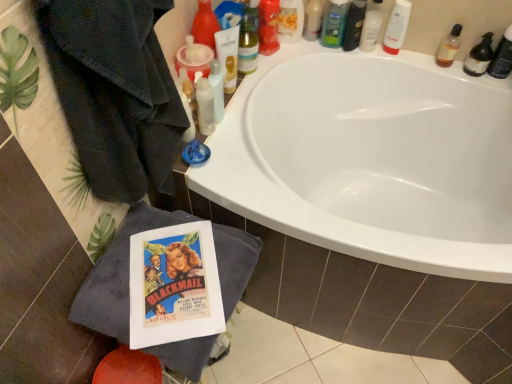
Where is `vintage paper comic book at lower left`? This screenshot has width=512, height=384. vintage paper comic book at lower left is located at coordinates (174, 285).

At what (x,y) coordinates should I click in order to perform the action: click on translucent plastic tube at upper center, the second mouthwash viewed from the right. Please return your answer as a coordinate pair (x, y). The image size is (512, 384). Looking at the image, I should click on (228, 56).

Measure the distance between white plastic bottle at upper right, which is the 7th toiletry from left to right, and camera.

They are 4.24 feet apart.

What is the approximate width of shiny plastic bottle at upper right, which appears as the fifth toiletry when viewed from the right?

It is 3.16 inches.

Find the location of a particular element. The image size is (512, 384). white plastic tube at upper right, acting as the 6th toiletry starting from the left is located at coordinates (371, 26).

Does translucent plastic bottle at upper center, the 9th toiletry positioned from the right, turn towards translucent plastic mouthwash at upper right, marked as the 2th mouthwash in a left-to-right arrangement?

No, translucent plastic bottle at upper center, the 9th toiletry positioned from the right, is not facing towards translucent plastic mouthwash at upper right, marked as the 2th mouthwash in a left-to-right arrangement.

Is translucent plastic mouthwash at upper right, marked as the 2th mouthwash in a left-to-right arrangement, inside translucent plastic bottle at upper center, the 9th toiletry positioned from the right?

No.

Which is more to the right, translucent plastic bottle at upper center, the 9th toiletry positioned from the right, or translucent plastic mouthwash at upper right, marked as the 2th mouthwash in a left-to-right arrangement?

translucent plastic mouthwash at upper right, marked as the 2th mouthwash in a left-to-right arrangement, is more to the right.

How different are the orientations of translucent plastic bottle at upper center, the 9th toiletry positioned from the right, and translucent plastic mouthwash at upper right, acting as the first mouthwash starting from the right, in degrees?

They differ by 95.4 degrees in their facing directions.

Is translucent plastic bottle at upper center, the 9th toiletry positioned from the right, inside shiny plastic bottle at upper right, which ranks as the 5th toiletry in left-to-right order?

Definitely not — translucent plastic bottle at upper center, the 9th toiletry positioned from the right, is not inside shiny plastic bottle at upper right, which ranks as the 5th toiletry in left-to-right order.

From a real-world perspective, starting from the translucent plastic bottle at upper center, the 9th toiletry positioned from the right, which toiletry is the 2nd one below it? Please provide its 2D coordinates.

[(354, 25)]

From a real-world perspective, who is located lower, shiny plastic bottle at upper right, which ranks as the 5th toiletry in left-to-right order, or translucent plastic bottle at upper center, the 9th toiletry positioned from the right?

shiny plastic bottle at upper right, which ranks as the 5th toiletry in left-to-right order, from a real-world perspective.

Is shiny plastic bottle at upper right, which appears as the fifth toiletry when viewed from the right, far away from translucent plastic bottle at upper center, the 9th toiletry positioned from the right?

No, shiny plastic bottle at upper right, which appears as the fifth toiletry when viewed from the right, is not far away from translucent plastic bottle at upper center, the 9th toiletry positioned from the right.

Based on the photo, is vintage paper comic book at lower left to the left of translucent plastic mouthwash at upper right, acting as the first mouthwash starting from the right, from the viewer's perspective?

Correct, you'll find vintage paper comic book at lower left to the left of translucent plastic mouthwash at upper right, acting as the first mouthwash starting from the right.

Considering the sizes of objects vintage paper comic book at lower left and translucent plastic mouthwash at upper right, marked as the 2th mouthwash in a left-to-right arrangement, in the image provided, who is shorter, vintage paper comic book at lower left or translucent plastic mouthwash at upper right, marked as the 2th mouthwash in a left-to-right arrangement,?

With less height is vintage paper comic book at lower left.

Which object is more forward, vintage paper comic book at lower left or translucent plastic mouthwash at upper right, acting as the first mouthwash starting from the right?

vintage paper comic book at lower left is in front.

Measure the distance from vintage paper comic book at lower left to translucent plastic mouthwash at upper right, marked as the 2th mouthwash in a left-to-right arrangement.

vintage paper comic book at lower left and translucent plastic mouthwash at upper right, marked as the 2th mouthwash in a left-to-right arrangement, are 3.55 feet apart from each other.

Is green matte bottle at upper center, positioned as the fourth toiletry in left-to-right order, taller than translucent plastic mouthwash at upper right, acting as the first mouthwash starting from the right?

Correct, green matte bottle at upper center, positioned as the fourth toiletry in left-to-right order, is much taller as translucent plastic mouthwash at upper right, acting as the first mouthwash starting from the right.

Is green matte bottle at upper center, positioned as the fourth toiletry in left-to-right order, positioned far away from translucent plastic mouthwash at upper right, marked as the 2th mouthwash in a left-to-right arrangement?

No, green matte bottle at upper center, positioned as the fourth toiletry in left-to-right order, is not far away from translucent plastic mouthwash at upper right, marked as the 2th mouthwash in a left-to-right arrangement.

The height and width of the screenshot is (384, 512). I want to click on mouthwash that is under the green matte bottle at upper center, the 6th toiletry from the right (from a real-world perspective), so click(479, 57).

Which is behind, point (336, 8) or point (479, 61)?

The point (336, 8) is more distant.

Looking at this image, from the image's perspective, between green matte bottle at upper center, positioned as the fourth toiletry in left-to-right order, and translucent plastic bottle at upper right, the 1th toiletry in the right-to-left sequence, who is located below?

translucent plastic bottle at upper right, the 1th toiletry in the right-to-left sequence, from the image's perspective.

Can you confirm if green matte bottle at upper center, positioned as the fourth toiletry in left-to-right order, is taller than translucent plastic bottle at upper right, the 1th toiletry in the right-to-left sequence?

In fact, green matte bottle at upper center, positioned as the fourth toiletry in left-to-right order, may be shorter than translucent plastic bottle at upper right, the 1th toiletry in the right-to-left sequence.

Choose the correct answer: Is green matte bottle at upper center, positioned as the fourth toiletry in left-to-right order, inside translucent plastic bottle at upper right, which ranks as the 9th toiletry in left-to-right order, or outside it?

green matte bottle at upper center, positioned as the fourth toiletry in left-to-right order, is outside translucent plastic bottle at upper right, which ranks as the 9th toiletry in left-to-right order.

Between green matte bottle at upper center, the 6th toiletry from the right, and translucent plastic bottle at upper right, which ranks as the 9th toiletry in left-to-right order, which one has smaller width?

With smaller width is translucent plastic bottle at upper right, which ranks as the 9th toiletry in left-to-right order.

Considering the sizes of objects translucent plastic bottle at upper right, arranged as the 8th toiletry when viewed from the left, and translucent plastic bottle at upper right, which ranks as the 9th toiletry in left-to-right order, in the image provided, who is bigger, translucent plastic bottle at upper right, arranged as the 8th toiletry when viewed from the left, or translucent plastic bottle at upper right, which ranks as the 9th toiletry in left-to-right order,?

translucent plastic bottle at upper right, which ranks as the 9th toiletry in left-to-right order, is bigger.

Is translucent plastic bottle at upper right, arranged as the 8th toiletry when viewed from the left, taller than translucent plastic bottle at upper right, the 1th toiletry in the right-to-left sequence?

No.

Measure the distance between translucent plastic bottle at upper right, which ranks as the 2th toiletry in right-to-left order, and translucent plastic bottle at upper right, which ranks as the 9th toiletry in left-to-right order.

The distance of translucent plastic bottle at upper right, which ranks as the 2th toiletry in right-to-left order, from translucent plastic bottle at upper right, which ranks as the 9th toiletry in left-to-right order, is 5.28 inches.

In the image, is translucent plastic bottle at upper right, which ranks as the 2th toiletry in right-to-left order, positioned in front of or behind translucent plastic bottle at upper right, which ranks as the 9th toiletry in left-to-right order?

Visually, translucent plastic bottle at upper right, which ranks as the 2th toiletry in right-to-left order, is located behind translucent plastic bottle at upper right, which ranks as the 9th toiletry in left-to-right order.

Is translucent plastic mouthwash at upper right, marked as the 2th mouthwash in a left-to-right arrangement, oriented towards translucent plastic bottle at upper center, the 9th toiletry positioned from the right?

No, translucent plastic mouthwash at upper right, marked as the 2th mouthwash in a left-to-right arrangement, does not turn towards translucent plastic bottle at upper center, the 9th toiletry positioned from the right.

Is translucent plastic mouthwash at upper right, acting as the first mouthwash starting from the right, bigger or smaller than translucent plastic bottle at upper center, which is the 1th toiletry in left-to-right order?

translucent plastic mouthwash at upper right, acting as the first mouthwash starting from the right, is bigger than translucent plastic bottle at upper center, which is the 1th toiletry in left-to-right order.

Can you confirm if translucent plastic mouthwash at upper right, marked as the 2th mouthwash in a left-to-right arrangement, is positioned to the right of translucent plastic bottle at upper center, the 9th toiletry positioned from the right?

Correct, you'll find translucent plastic mouthwash at upper right, marked as the 2th mouthwash in a left-to-right arrangement, to the right of translucent plastic bottle at upper center, the 9th toiletry positioned from the right.

Is translucent plastic mouthwash at upper right, acting as the first mouthwash starting from the right, positioned far away from translucent plastic bottle at upper center, which is the 1th toiletry in left-to-right order?

No, translucent plastic mouthwash at upper right, acting as the first mouthwash starting from the right, is not far away from translucent plastic bottle at upper center, which is the 1th toiletry in left-to-right order.

Where is `the 2nd toiletry in front of the translucent plastic mouthwash at upper right, marked as the 2th mouthwash in a left-to-right arrangement`? This screenshot has width=512, height=384. the 2nd toiletry in front of the translucent plastic mouthwash at upper right, marked as the 2th mouthwash in a left-to-right arrangement is located at coordinates (205, 107).

This screenshot has height=384, width=512. I want to click on the 2nd toiletry positioned above the shiny plastic bottle at upper right, which ranks as the 5th toiletry in left-to-right order (from a real-world perspective), so click(x=205, y=107).

Based on their spatial positions, is translucent plastic mouthwash at upper right, marked as the 2th mouthwash in a left-to-right arrangement, or vintage paper comic book at lower left closer to white plastic bottle at upper right, the third toiletry positioned from the right?

Based on the image, translucent plastic mouthwash at upper right, marked as the 2th mouthwash in a left-to-right arrangement, appears to be nearer to white plastic bottle at upper right, the third toiletry positioned from the right.

When comparing their distances from translucent plastic bottle at upper center, which appears as the 3th toiletry when viewed from the left, does translucent plastic bottle at upper right, the 1th toiletry in the right-to-left sequence, or shiny plastic bottle at upper center, acting as the eighth toiletry starting from the right, seem closer?

shiny plastic bottle at upper center, acting as the eighth toiletry starting from the right, is positioned closer to the anchor translucent plastic bottle at upper center, which appears as the 3th toiletry when viewed from the left.

Looking at the image, which one is located further to white plastic bottle at upper right, the third toiletry positioned from the right, translucent plastic bottle at upper center, the 9th toiletry positioned from the right, or translucent plastic bottle at upper right, the 1th toiletry in the right-to-left sequence?

The object further to white plastic bottle at upper right, the third toiletry positioned from the right, is translucent plastic bottle at upper center, the 9th toiletry positioned from the right.

From the image, which object appears to be nearer to translucent plastic bottle at upper center, the 9th toiletry positioned from the right, green matte bottle at upper center, the 6th toiletry from the right, or white plastic tube at upper right, acting as the 6th toiletry starting from the left?

Among the two, green matte bottle at upper center, the 6th toiletry from the right, is located nearer to translucent plastic bottle at upper center, the 9th toiletry positioned from the right.

Which object lies nearer to the anchor point translucent plastic bottle at upper center, which appears as the 3th toiletry when viewed from the left, gray cotton bath towel at lower left or shiny plastic bottle at upper right, which appears as the fifth toiletry when viewed from the right?

Among the two, shiny plastic bottle at upper right, which appears as the fifth toiletry when viewed from the right, is located nearer to translucent plastic bottle at upper center, which appears as the 3th toiletry when viewed from the left.

Looking at the image, which one is located closer to shiny plastic bottle at upper center, acting as the eighth toiletry starting from the right, gray cotton bath towel at lower left or translucent plastic mouthwash at upper right, marked as the 2th mouthwash in a left-to-right arrangement?

translucent plastic mouthwash at upper right, marked as the 2th mouthwash in a left-to-right arrangement, is positioned closer to the anchor shiny plastic bottle at upper center, acting as the eighth toiletry starting from the right.

Estimate the real-world distances between objects in this image. Which object is closer to translucent plastic bottle at upper right, arranged as the 8th toiletry when viewed from the left, green matte bottle at upper center, positioned as the fourth toiletry in left-to-right order, or gray cotton bath towel at lower left?

green matte bottle at upper center, positioned as the fourth toiletry in left-to-right order, is closer to translucent plastic bottle at upper right, arranged as the 8th toiletry when viewed from the left.

From the image, which object appears to be nearer to translucent plastic bottle at upper center, which appears as the 3th toiletry when viewed from the left, shiny plastic bottle at upper right, which ranks as the 5th toiletry in left-to-right order, or translucent plastic tube at upper center, the second mouthwash viewed from the right?

The object closer to translucent plastic bottle at upper center, which appears as the 3th toiletry when viewed from the left, is shiny plastic bottle at upper right, which ranks as the 5th toiletry in left-to-right order.

The width and height of the screenshot is (512, 384). Identify the location of mouthwash situated between translucent plastic bottle at upper center, the 9th toiletry positioned from the right, and white plastic bottle at upper right, which is the 7th toiletry from left to right, from left to right. (228, 56).

Where is `comic book between shiny plastic bottle at upper center, the 2th toiletry from the left, and gray cotton bath towel at lower left from top to bottom`? The height and width of the screenshot is (384, 512). comic book between shiny plastic bottle at upper center, the 2th toiletry from the left, and gray cotton bath towel at lower left from top to bottom is located at coordinates point(174,285).

At what (x,y) coordinates should I click in order to perform the action: click on comic book between shiny plastic bottle at upper right, which ranks as the 5th toiletry in left-to-right order, and gray cotton bath towel at lower left in the up-down direction. Please return your answer as a coordinate pair (x, y). Looking at the image, I should click on (174, 285).

You are a GUI agent. You are given a task and a screenshot of the screen. Output one action in this format:
    pyautogui.click(x=<x>, y=<y>)
    Task: Click on the comic book between green matte bottle at upper center, the 6th toiletry from the right, and gray cotton bath towel at lower left vertically
    Image resolution: width=512 pixels, height=384 pixels.
    Given the screenshot: What is the action you would take?
    pyautogui.click(x=174, y=285)